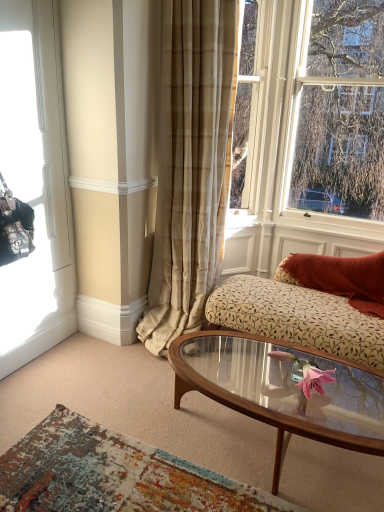
Question: Is wooden glass coffee table at center taller than distressed rug at lower left?

Choices:
 (A) no
 (B) yes

Answer: (B)

Question: Does wooden glass coffee table at center have a lesser height compared to distressed rug at lower left?

Choices:
 (A) no
 (B) yes

Answer: (A)

Question: Is wooden glass coffee table at center thinner than distressed rug at lower left?

Choices:
 (A) no
 (B) yes

Answer: (B)

Question: Is wooden glass coffee table at center smaller than distressed rug at lower left?

Choices:
 (A) yes
 (B) no

Answer: (B)

Question: From a real-world perspective, is wooden glass coffee table at center below distressed rug at lower left?

Choices:
 (A) no
 (B) yes

Answer: (A)

Question: From the image's perspective, is wooden glass coffee table at center above or below clear glass window at upper right, the first window in the right-to-left sequence?

Choices:
 (A) below
 (B) above

Answer: (A)

Question: From a real-world perspective, is wooden glass coffee table at center physically located above or below clear glass window at upper right, the first window in the right-to-left sequence?

Choices:
 (A) above
 (B) below

Answer: (B)

Question: Would you say wooden glass coffee table at center is to the left or to the right of clear glass window at upper right, the first window in the right-to-left sequence, in the picture?

Choices:
 (A) right
 (B) left

Answer: (B)

Question: In terms of height, does wooden glass coffee table at center look taller or shorter compared to clear glass window at upper right, which appears as the second window when viewed from the left?

Choices:
 (A) tall
 (B) short

Answer: (B)

Question: Visually, is black leather handbag at left, the second window when ordered from right to left, positioned to the left or to the right of distressed rug at lower left?

Choices:
 (A) left
 (B) right

Answer: (A)

Question: Is black leather handbag at left, the second window when ordered from right to left, wider or thinner than distressed rug at lower left?

Choices:
 (A) thin
 (B) wide

Answer: (A)

Question: Does point (8, 169) appear closer or farther from the camera than point (41, 504)?

Choices:
 (A) closer
 (B) farther

Answer: (B)

Question: In terms of size, does black leather handbag at left, positioned as the 1th window in left-to-right order, appear bigger or smaller than distressed rug at lower left?

Choices:
 (A) big
 (B) small

Answer: (A)

Question: Looking at the image, does wooden glass coffee table at center seem bigger or smaller compared to distressed rug at lower left?

Choices:
 (A) small
 (B) big

Answer: (B)

Question: Based on their positions, is wooden glass coffee table at center located to the left or right of distressed rug at lower left?

Choices:
 (A) right
 (B) left

Answer: (A)